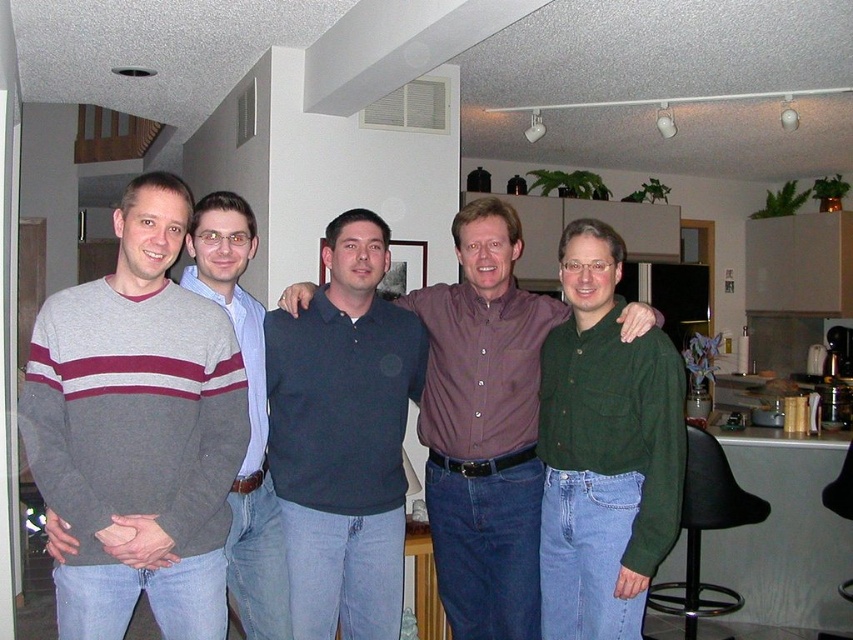
Does point (334, 586) come behind point (619, 259)?

That is True.

Is dark blue polo shirt at center thinner than green cotton shirt at center?

No.

Is point (374, 612) positioned behind point (575, 461)?

Yes, point (374, 612) is farther from viewer.

I want to click on dark blue polo shirt at center, so click(343, 436).

Between dark blue polo shirt at center and black plastic stool at lower right, which one has less height?

Standing shorter between the two is black plastic stool at lower right.

Is dark blue polo shirt at center to the right of black plastic stool at lower right from the viewer's perspective?

In fact, dark blue polo shirt at center is to the left of black plastic stool at lower right.

Is point (306, 632) behind point (695, 628)?

No, (306, 632) is closer to viewer.

This screenshot has height=640, width=853. I want to click on dark blue polo shirt at center, so (x=343, y=436).

Can you confirm if dark blue polo shirt at center is positioned below dark blue shirt at center?

Indeed, dark blue polo shirt at center is positioned under dark blue shirt at center.

Who is more forward, (299, 634) or (440, 508)?

Point (299, 634) is more forward.

This screenshot has width=853, height=640. Find the location of `dark blue polo shirt at center`. dark blue polo shirt at center is located at coordinates (343, 436).